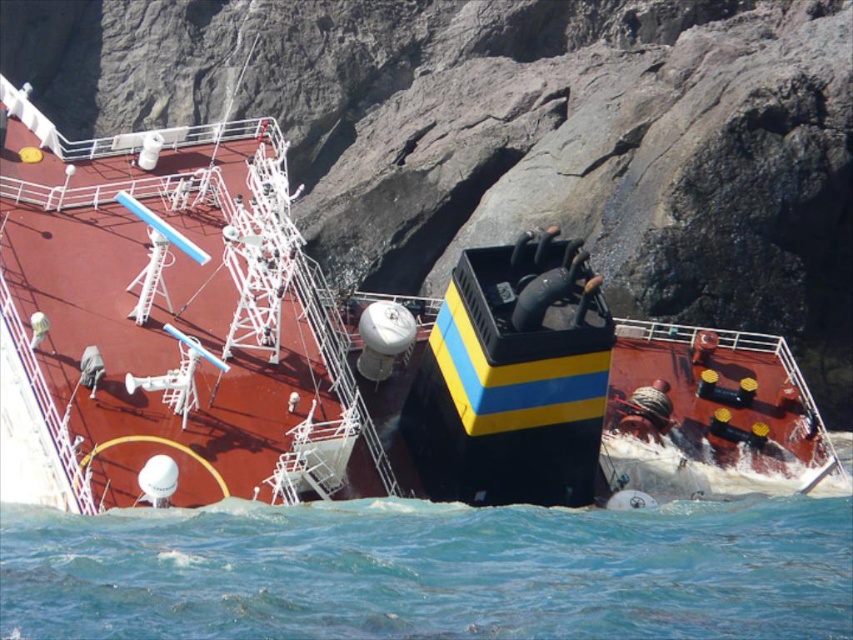
You are standing on the deck of the shiny black ship at center. You want to take a photo of the ship from a distance to show its entire structure. Considering the camera you have can capture objects up to 60 meters away clearly, will you be able to capture the entire ship in one shot?

The shiny black ship at center and camera are 58.75 meters apart from each other. Since the camera can capture up to 60 meters clearly, you can capture the entire ship in one shot as the distance is within the camera range.

You are a marine biologist studying shipwrecks. You have a map that shows coordinates for a shipwreck located at point 0.548, 0.392. Based on the image provided, can you confirm if the shiny black ship at center is the shipwreck you are looking for?

Yes, the shiny black ship at center is located at point (334, 349), which matches the coordinates on your map, so it is the shipwreck you are looking for.